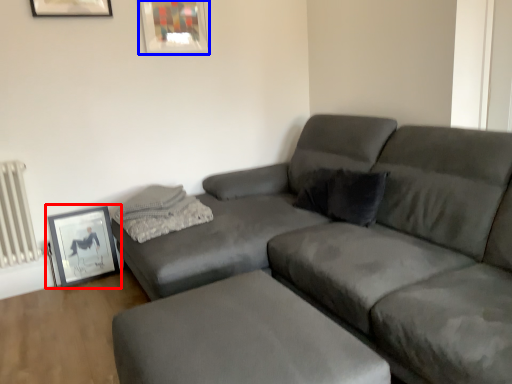
Question: Which point is further to the camera, picture frame (highlighted by a red box) or picture frame (highlighted by a blue box)?

Choices:
 (A) picture frame
 (B) picture frame

Answer: (B)